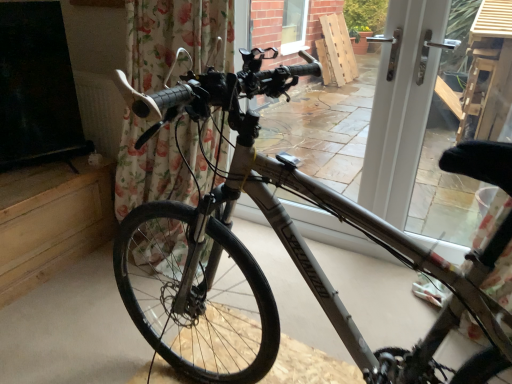
The height and width of the screenshot is (384, 512). What are the coordinates of `silver metallic bicycle at center` in the screenshot? It's located at (289, 254).

Measure the distance between white plastic door at center and silver metallic bicycle at center.

white plastic door at center and silver metallic bicycle at center are 32.54 inches apart from each other.

Can you confirm if white plastic door at center is shorter than silver metallic bicycle at center?

Yes, white plastic door at center is shorter than silver metallic bicycle at center.

From the image's perspective, which is below, white plastic door at center or silver metallic bicycle at center?

silver metallic bicycle at center is shown below in the image.

Considering the relative sizes of floral fabric curtain at left and silver metallic bicycle at center in the image provided, is floral fabric curtain at left smaller than silver metallic bicycle at center?

Correct, floral fabric curtain at left occupies less space than silver metallic bicycle at center.

Identify the location of bicycle lying below the floral fabric curtain at left (from the image's perspective). This screenshot has height=384, width=512. (289, 254).

Between floral fabric curtain at left and silver metallic bicycle at center, which one appears on the right side from the viewer's perspective?

silver metallic bicycle at center is more to the right.

Is silver metallic bicycle at center a part of floral fabric curtain at left?

Actually, silver metallic bicycle at center is outside floral fabric curtain at left.

Which is in front, floral fabric curtain at left or white plastic door at center?

floral fabric curtain at left is closer to the camera.

How many degrees apart are the facing directions of floral fabric curtain at left and white plastic door at center?

They differ by 0.343 degrees in their facing directions.

Is there a large distance between floral fabric curtain at left and white plastic door at center?

floral fabric curtain at left is near white plastic door at center, not far away.

In the image, is white plastic door at center positioned in front of or behind floral fabric curtain at left?

In the image, white plastic door at center appears behind floral fabric curtain at left.

In the scene shown: What's the angular difference between white plastic door at center and floral fabric curtain at left's facing directions?

0.343 degrees.

Based on their sizes in the image, would you say white plastic door at center is bigger or smaller than floral fabric curtain at left?

Clearly, white plastic door at center is smaller in size than floral fabric curtain at left.

Is white plastic door at center shorter than floral fabric curtain at left?

Yes.

Considering the relative sizes of silver metallic bicycle at center and white plastic door at center in the image provided, is silver metallic bicycle at center shorter than white plastic door at center?

No, silver metallic bicycle at center is not shorter than white plastic door at center.

Is silver metallic bicycle at center positioned far away from white plastic door at center?

Actually, silver metallic bicycle at center and white plastic door at center are a little close together.

Which is in front, point (234, 335) or point (430, 26)?

Positioned in front is point (234, 335).

Looking at their sizes, would you say silver metallic bicycle at center is wider or thinner than white plastic door at center?

Considering their sizes, silver metallic bicycle at center looks broader than white plastic door at center.

Is silver metallic bicycle at center oriented towards floral fabric curtain at left?

No, silver metallic bicycle at center does not turn towards floral fabric curtain at left.

Based on the photo, would you say silver metallic bicycle at center is outside floral fabric curtain at left?

Indeed, silver metallic bicycle at center is completely outside floral fabric curtain at left.

Identify the location of window frame located above the silver metallic bicycle at center (from the image's perspective). The height and width of the screenshot is (384, 512). (400, 115).

The height and width of the screenshot is (384, 512). I want to click on bicycle located on the right of floral fabric curtain at left, so click(289, 254).

When comparing their distances from floral fabric curtain at left, does silver metallic bicycle at center or white plastic door at center seem further?

The object further to floral fabric curtain at left is white plastic door at center.

Which object lies further to the anchor point white plastic door at center, floral fabric curtain at left or silver metallic bicycle at center?

floral fabric curtain at left.

Looking at the image, which one is located further to silver metallic bicycle at center, floral fabric curtain at left or white plastic door at center?

white plastic door at center is positioned further to the anchor silver metallic bicycle at center.

From the image, which object appears to be farther from floral fabric curtain at left, white plastic door at center or silver metallic bicycle at center?

white plastic door at center is further to floral fabric curtain at left.

Based on their spatial positions, is silver metallic bicycle at center or floral fabric curtain at left closer to white plastic door at center?

The object closer to white plastic door at center is silver metallic bicycle at center.

Estimate the real-world distances between objects in this image. Which object is further from silver metallic bicycle at center, white plastic door at center or floral fabric curtain at left?

white plastic door at center is further to silver metallic bicycle at center.

At what (x,y) coordinates should I click in order to perform the action: click on curtain located between silver metallic bicycle at center and white plastic door at center in the depth direction. Please return your answer as a coordinate pair (x, y). Looking at the image, I should click on (164, 163).